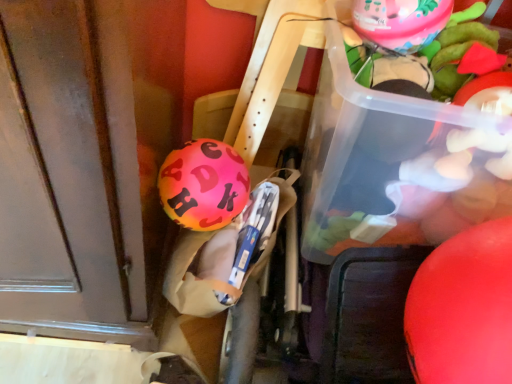
Question: Is pink rubber balloon at upper right, positioned as the 2th balloon in left-to-right order, positioned beyond the bounds of rubber matte balloon at right, which ranks as the third balloon in left-to-right order?

Choices:
 (A) yes
 (B) no

Answer: (A)

Question: Is pink rubber balloon at upper right, positioned as the second balloon in right-to-left order, taller than rubber matte balloon at right, the first balloon in the right-to-left sequence?

Choices:
 (A) yes
 (B) no

Answer: (B)

Question: Does pink rubber balloon at upper right, placed as the third balloon when sorted from bottom to top, have a smaller size compared to rubber matte balloon at right, which is the 3th balloon in top-to-bottom order?

Choices:
 (A) no
 (B) yes

Answer: (B)

Question: From a real-world perspective, is pink rubber balloon at upper right, positioned as the 2th balloon in left-to-right order, on rubber matte balloon at right, the first balloon from the bottom?

Choices:
 (A) yes
 (B) no

Answer: (A)

Question: Considering the relative positions of pink rubber balloon at upper right, marked as the first balloon in a top-to-bottom arrangement, and rubber matte balloon at right, which ranks as the third balloon in left-to-right order, in the image provided, is pink rubber balloon at upper right, marked as the first balloon in a top-to-bottom arrangement, to the left of rubber matte balloon at right, which ranks as the third balloon in left-to-right order, from the viewer's perspective?

Choices:
 (A) no
 (B) yes

Answer: (B)

Question: Is shiny pink balloon at center, which is the second balloon in top-to-bottom order, inside or outside of rubber matte balloon at right, which is the 3th balloon in top-to-bottom order?

Choices:
 (A) inside
 (B) outside

Answer: (B)

Question: Based on their sizes in the image, would you say shiny pink balloon at center, which is the second balloon in top-to-bottom order, is bigger or smaller than rubber matte balloon at right, which is the 3th balloon in top-to-bottom order?

Choices:
 (A) small
 (B) big

Answer: (A)

Question: Is point (201, 185) positioned closer to the camera than point (420, 357)?

Choices:
 (A) farther
 (B) closer

Answer: (A)

Question: Is shiny pink balloon at center, the 2th balloon from the bottom, wider or thinner than rubber matte balloon at right, the first balloon from the bottom?

Choices:
 (A) thin
 (B) wide

Answer: (A)

Question: Considering the positions of translucent plastic container at upper right and shiny pink balloon at center, the 2th balloon from the bottom, in the image, is translucent plastic container at upper right bigger or smaller than shiny pink balloon at center, the 2th balloon from the bottom,?

Choices:
 (A) small
 (B) big

Answer: (B)

Question: Considering the positions of translucent plastic container at upper right and shiny pink balloon at center, the 2th balloon from the bottom, in the image, is translucent plastic container at upper right wider or thinner than shiny pink balloon at center, the 2th balloon from the bottom,?

Choices:
 (A) wide
 (B) thin

Answer: (A)

Question: Is translucent plastic container at upper right taller or shorter than shiny pink balloon at center, acting as the third balloon starting from the right?

Choices:
 (A) tall
 (B) short

Answer: (A)

Question: From a real-world perspective, is translucent plastic container at upper right positioned above or below shiny pink balloon at center, which is the second balloon in top-to-bottom order?

Choices:
 (A) below
 (B) above

Answer: (B)

Question: From the image's perspective, is shiny pink balloon at center, which is the second balloon in top-to-bottom order, positioned above or below translucent plastic container at upper right?

Choices:
 (A) below
 (B) above

Answer: (A)

Question: Based on their sizes in the image, would you say shiny pink balloon at center, acting as the third balloon starting from the right, is bigger or smaller than translucent plastic container at upper right?

Choices:
 (A) big
 (B) small

Answer: (B)